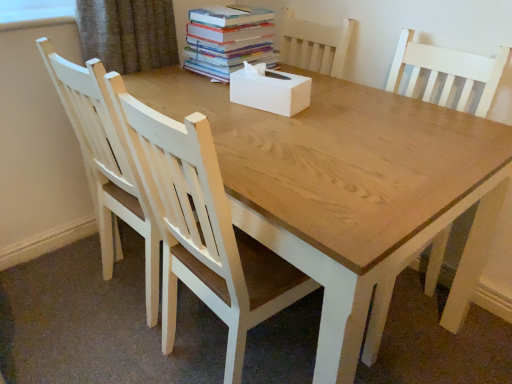
The height and width of the screenshot is (384, 512). What are the coordinates of `vacant space to the left of white wood chair at center, which is the first chair from right to left` in the screenshot? It's located at (99, 344).